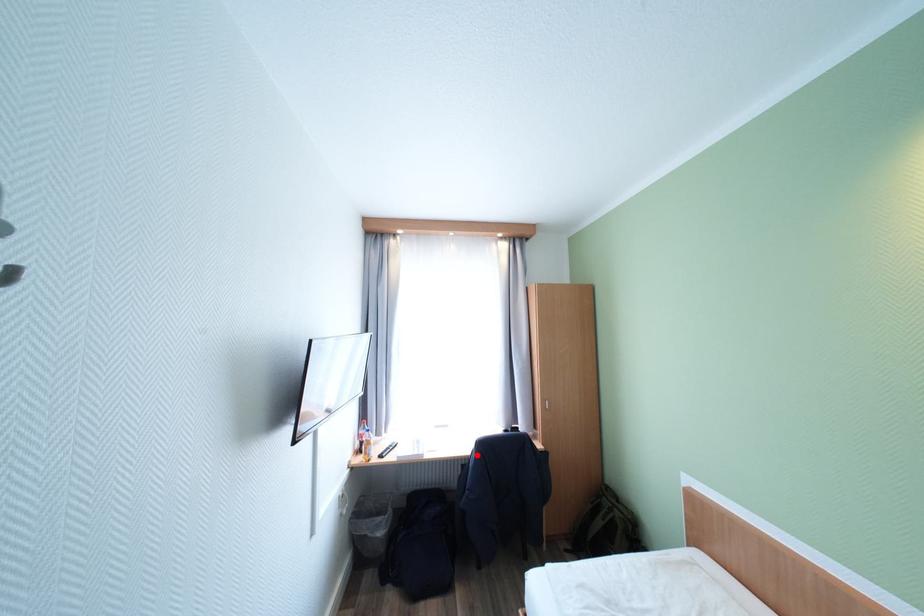
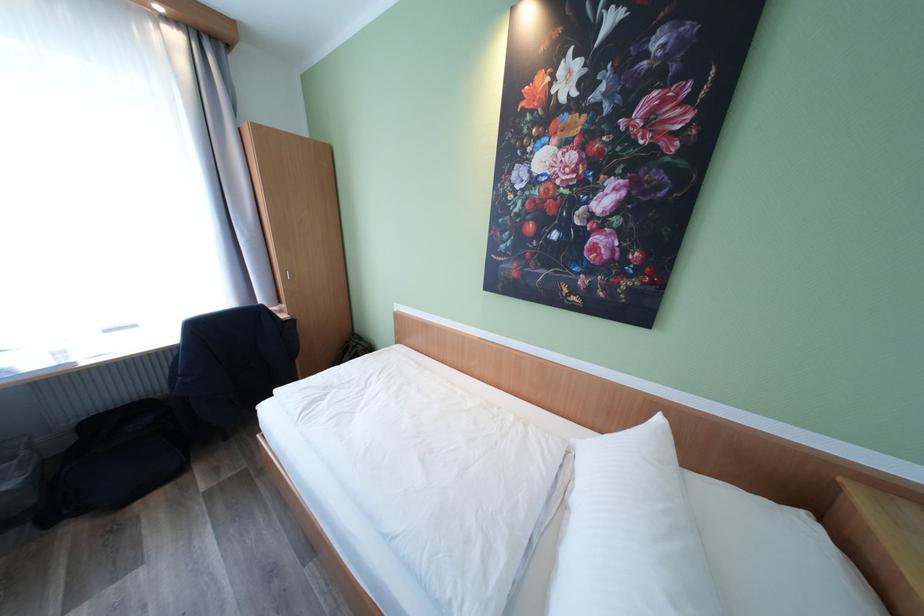
Question: I am providing you with two images of the same scene from different viewpoints. A red point is marked on the first image. At the location where the point appears in image 1, is it still visible in image 2?

Choices:
 (A) Yes
 (B) No

Answer: (B)